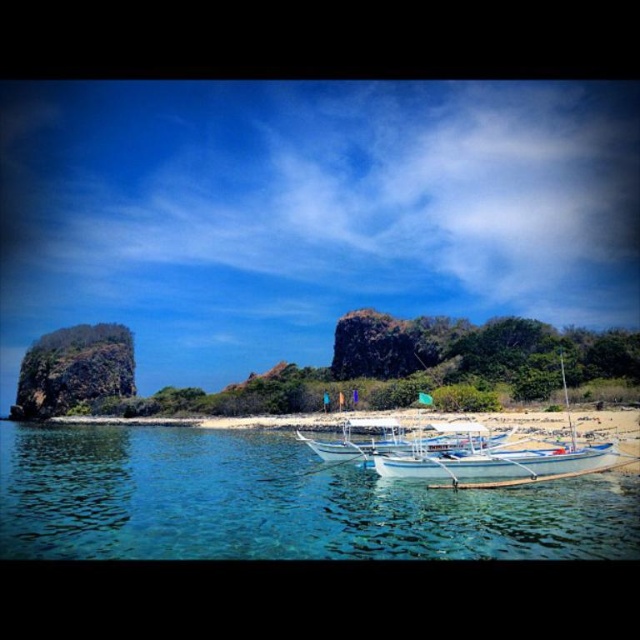
Question: Which point appears closest to the camera in this image?

Choices:
 (A) click(x=291, y=525)
 (B) click(x=582, y=460)

Answer: (A)

Question: Can you confirm if clear blue water at lower center is wider than white wooden boat at center?

Choices:
 (A) no
 (B) yes

Answer: (B)

Question: Which object appears closest to the camera in this image?

Choices:
 (A) clear blue water at lower center
 (B) white wooden boat at center

Answer: (A)

Question: Can you confirm if clear blue water at lower center is positioned to the left of white wooden boat at center?

Choices:
 (A) no
 (B) yes

Answer: (B)

Question: Is clear blue water at lower center in front of white wooden boat at center?

Choices:
 (A) yes
 (B) no

Answer: (A)